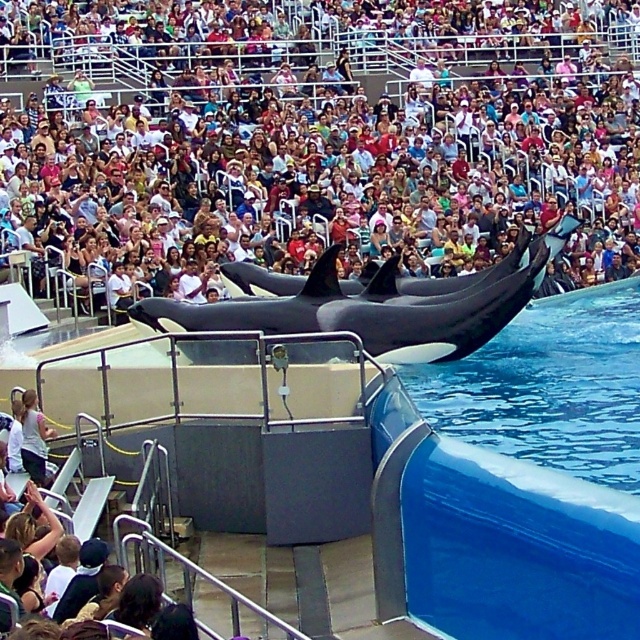
Question: Which point appears farthest from the camera in this image?

Choices:
 (A) (28, 467)
 (B) (339, 321)

Answer: (B)

Question: Can you confirm if black smooth orca at center is thinner than light pink fabric shirt at lower left?

Choices:
 (A) no
 (B) yes

Answer: (A)

Question: Which point appears closest to the camera in this image?

Choices:
 (A) (374, 310)
 (B) (284, 12)
 (C) (40, 422)

Answer: (C)

Question: Is matte black orca at center positioned at the back of black smooth orca at center?

Choices:
 (A) no
 (B) yes

Answer: (B)

Question: Which of the following is the closest to the observer?

Choices:
 (A) (186, 352)
 (B) (458, 104)
 (C) (36, 401)

Answer: (C)

Question: In this image, where is matte black orca at center located relative to light pink fabric shirt at lower left?

Choices:
 (A) below
 (B) above

Answer: (B)